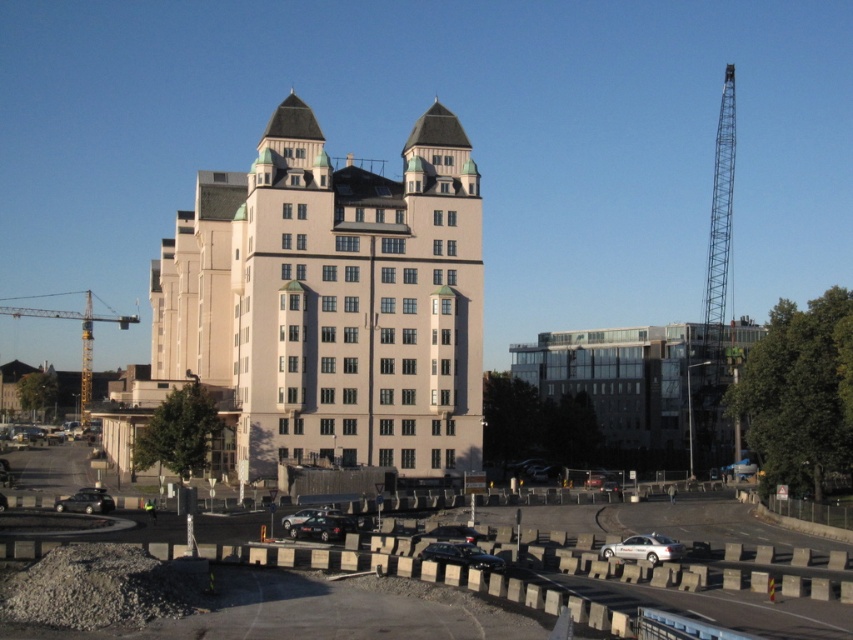
Question: Does beige concrete building at center have a smaller size compared to metallic silver car at center?

Choices:
 (A) no
 (B) yes

Answer: (A)

Question: Considering the real-world distances, which object is closest to the matte black car at lower left?

Choices:
 (A) yellow metallic crane at left
 (B) metallic silver car at center
 (C) beige concrete building at center

Answer: (C)

Question: Which object appears farthest from the camera in this image?

Choices:
 (A) gray concrete barriers at lower center
 (B) metallic silver car at center
 (C) shiny black car at lower center
 (D) matte black car at lower left

Answer: (D)

Question: Does shiny black car at lower center appear on the right side of matte black car at lower left?

Choices:
 (A) yes
 (B) no

Answer: (A)

Question: Is shiny black car at lower center thinner than metallic silver sedan at center?

Choices:
 (A) yes
 (B) no

Answer: (A)

Question: Among these objects, which one is nearest to the camera?

Choices:
 (A) silver metallic car at lower center
 (B) gray concrete barriers at lower center
 (C) shiny black car at lower center

Answer: (B)